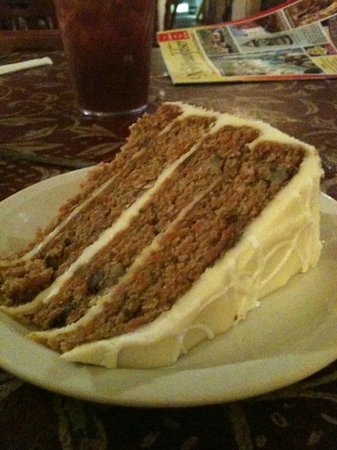
The width and height of the screenshot is (337, 450). In order to click on glass in this screenshot , I will do `click(109, 43)`.